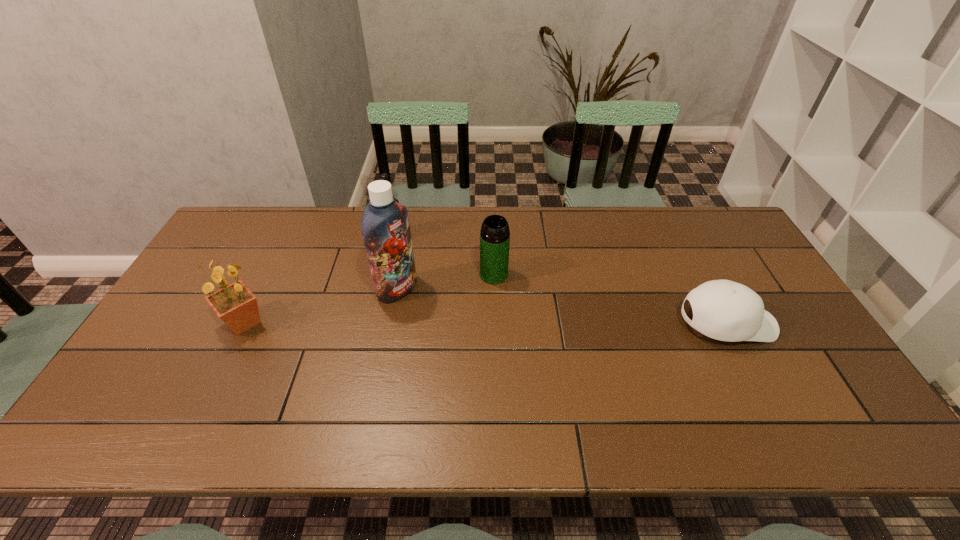
Where is `vacant space located on the label of the farthest object`? Image resolution: width=960 pixels, height=540 pixels. vacant space located on the label of the farthest object is located at coordinates (413, 252).

Where is `vacant point located on the front label of the shampoo`? This screenshot has width=960, height=540. vacant point located on the front label of the shampoo is located at coordinates click(x=527, y=369).

At what (x,y) coordinates should I click in order to perform the action: click on free space located 0.150m on the front label of the shampoo. Please return your answer as a coordinate pair (x, y). Looking at the image, I should click on (450, 323).

The width and height of the screenshot is (960, 540). I want to click on vacant space located 0.310m on the front label of the shampoo, so coord(497,352).

Image resolution: width=960 pixels, height=540 pixels. What are the coordinates of `free space located from the spout of the thermos bottle` in the screenshot? It's located at (526, 318).

Find the location of a particular element. This screenshot has width=960, height=540. blank area located 0.300m from the spout of the thermos bottle is located at coordinates (556, 357).

You are a GUI agent. You are given a task and a screenshot of the screen. Output one action in this format:
    pyautogui.click(x=<x>, y=<y>)
    Task: Click on the vacant space located from the spout of the thermos bottle
    
    Given the screenshot: What is the action you would take?
    pyautogui.click(x=524, y=315)

What are the coordinates of `object situated at the far edge` in the screenshot? It's located at (384, 176).

Find the location of a particular element. object present at the left edge is located at coordinates (235, 304).

This screenshot has width=960, height=540. I want to click on object at the right edge, so click(724, 310).